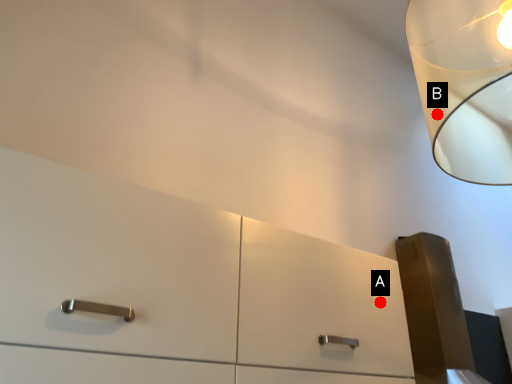
Question: Two points are circled on the image, labeled by A and B beside each circle. Which point is closer to the camera?

Choices:
 (A) A is closer
 (B) B is closer

Answer: (A)